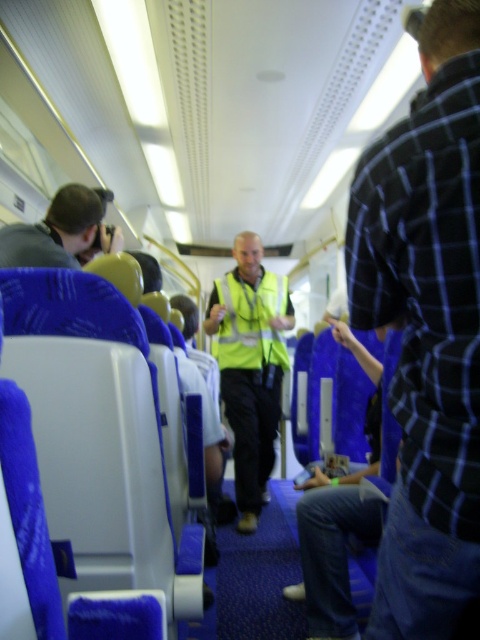
Question: Based on their relative distances, which object is farther from the plaid shirt at right?

Choices:
 (A) matte black camera at left
 (B) yellow reflective safety vest at center
 (C) high visibility yellow vest at center

Answer: (B)

Question: Can you confirm if plaid shirt at right is smaller than high visibility yellow vest at center?

Choices:
 (A) yes
 (B) no

Answer: (A)

Question: Which of the following is the closest to the observer?

Choices:
 (A) matte black camera at left
 (B) high visibility yellow vest at center
 (C) yellow reflective safety vest at center
 (D) plaid shirt at right

Answer: (D)

Question: Is matte black camera at left to the right of yellow reflective safety vest at center from the viewer's perspective?

Choices:
 (A) yes
 (B) no

Answer: (B)

Question: Which point is farther to the camera?

Choices:
 (A) (283, 339)
 (B) (35, 228)
 (C) (257, 260)
 (D) (429, 577)

Answer: (C)

Question: Is plaid shirt at right thinner than yellow reflective safety vest at center?

Choices:
 (A) no
 (B) yes

Answer: (B)